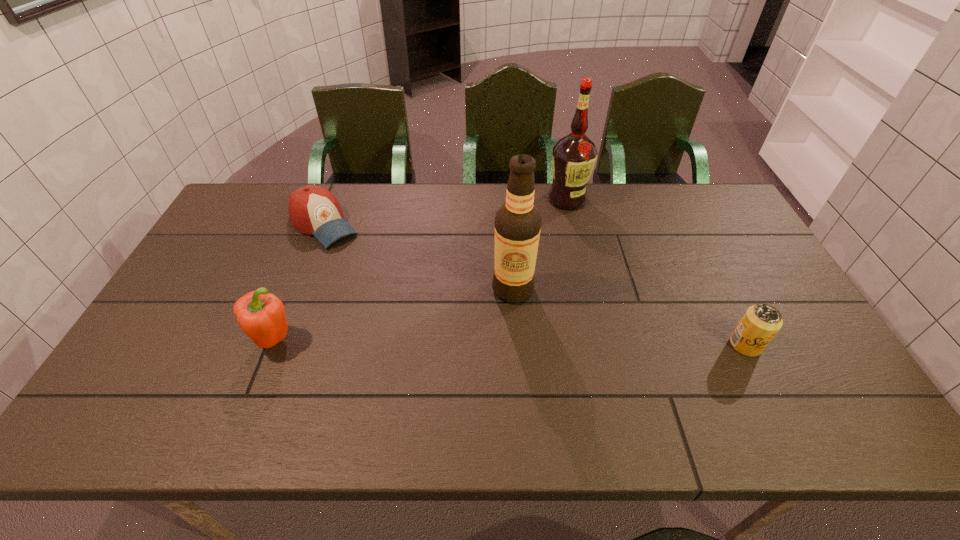
Find the location of a particular element. Image resolution: width=960 pixels, height=540 pixels. free space between the pepper and the third object from right to left is located at coordinates (394, 315).

The width and height of the screenshot is (960, 540). What are the coordinates of `vacant space that is in between the pepper and the beer can` in the screenshot? It's located at (510, 342).

The height and width of the screenshot is (540, 960). What are the coordinates of `vacant area between the baseball cap and the third tallest object` in the screenshot? It's located at (299, 282).

You are a GUI agent. You are given a task and a screenshot of the screen. Output one action in this format:
    pyautogui.click(x=<x>, y=<y>)
    Task: Click on the object that is the third closest one to the nearer alcohol
    The height and width of the screenshot is (540, 960).
    Given the screenshot: What is the action you would take?
    pyautogui.click(x=761, y=322)

Locate which object is the second closest to the pepper. Please provide its 2D coordinates. Your answer should be formatted as a tuple, i.e. [(x, y)], where the tuple contains the x and y coordinates of a point satisfying the conditions above.

[(518, 222)]

This screenshot has height=540, width=960. Find the location of `free location that satisfies the following two spatial constraints: 1. on the back side of the second object from right to left; 2. on the left side of the baseball cap`. free location that satisfies the following two spatial constraints: 1. on the back side of the second object from right to left; 2. on the left side of the baseball cap is located at coordinates (333, 199).